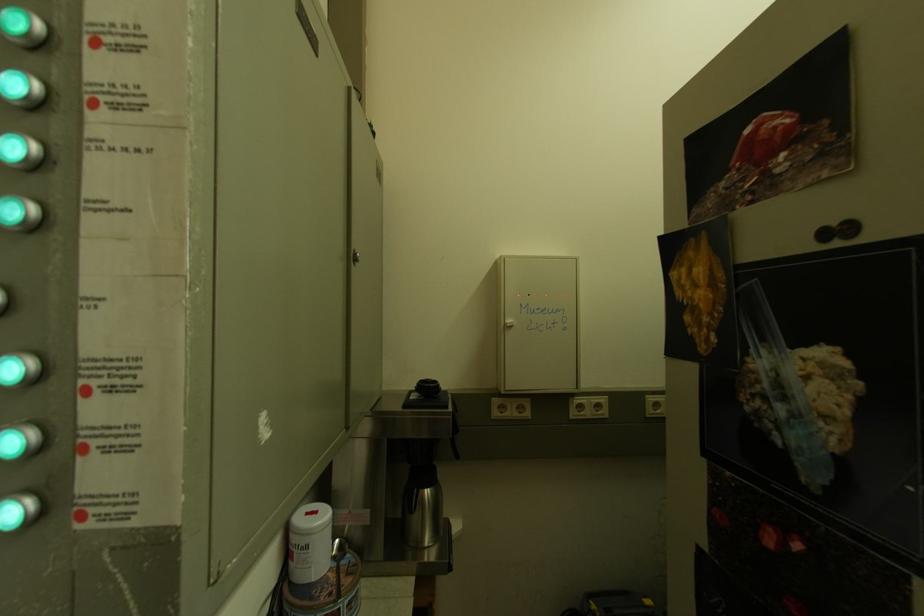
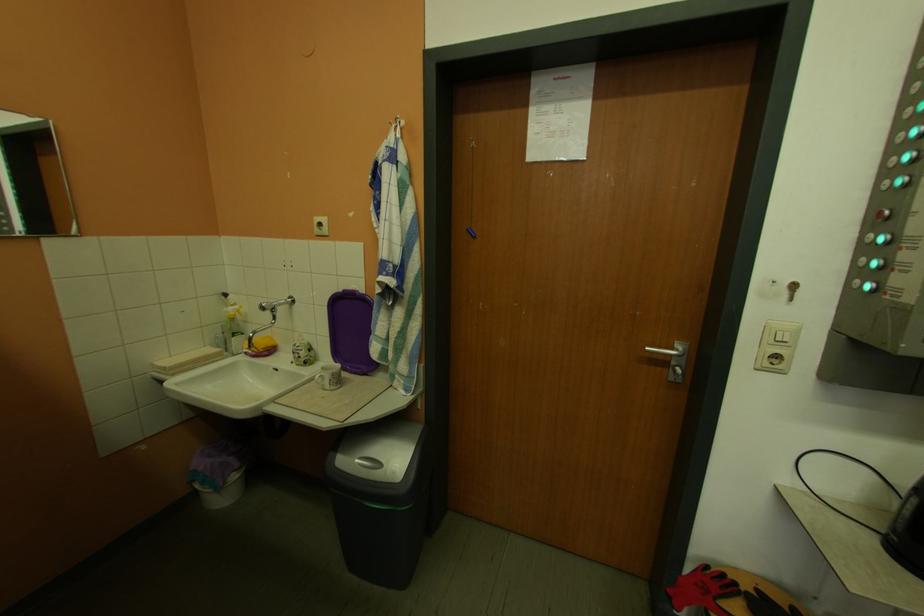
Question: Based on the continuous images, in which direction is the camera rotating? Reply with the corresponding letter.

Choices:
 (A) Left
 (B) Right
 (C) Up
 (D) Down

Answer: (A)